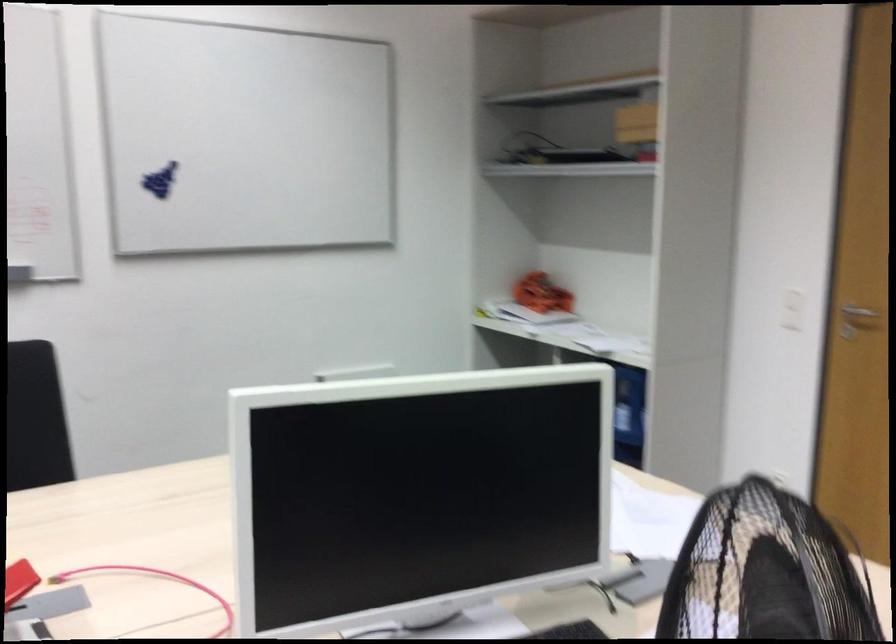
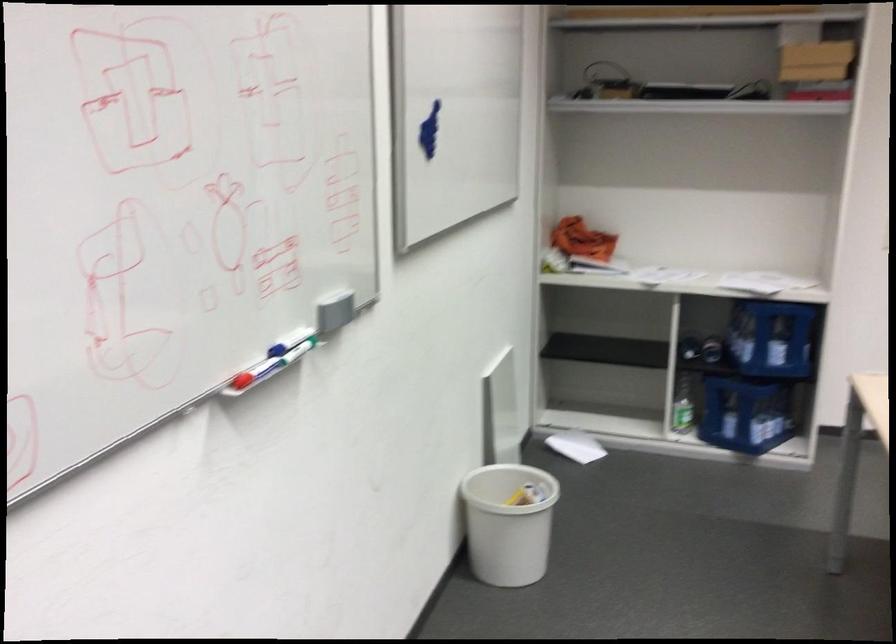
Locate, in the second image, the point that corresponds to point (75, 256) in the first image.

(334, 310)